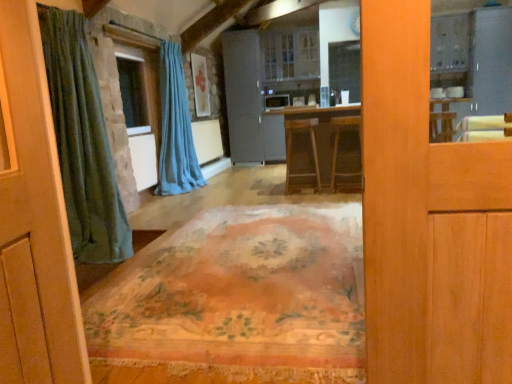
Question: Is blue fabric curtain at center directly adjacent to satin gray refrigerator at center, the second screen door when ordered from right to left?

Choices:
 (A) no
 (B) yes

Answer: (A)

Question: Does blue fabric curtain at center turn towards satin gray refrigerator at center, the 1th screen door from the left?

Choices:
 (A) yes
 (B) no

Answer: (B)

Question: Is blue fabric curtain at center smaller than satin gray refrigerator at center, the 1th screen door from the left?

Choices:
 (A) no
 (B) yes

Answer: (B)

Question: From the image's perspective, is blue fabric curtain at center located above satin gray refrigerator at center, the 1th screen door from the left?

Choices:
 (A) yes
 (B) no

Answer: (B)

Question: Is blue fabric curtain at center to the left of satin gray refrigerator at center, the 1th screen door from the left, from the viewer's perspective?

Choices:
 (A) yes
 (B) no

Answer: (A)

Question: Is blue fabric curtain at center located outside satin gray refrigerator at center, the 1th screen door from the left?

Choices:
 (A) no
 (B) yes

Answer: (B)

Question: Is blue fabric curtain at center taller than matte gray cabinet at center?

Choices:
 (A) no
 (B) yes

Answer: (B)

Question: From a real-world perspective, is blue fabric curtain at center positioned over matte gray cabinet at center based on gravity?

Choices:
 (A) yes
 (B) no

Answer: (B)

Question: Are blue fabric curtain at center and matte gray cabinet at center located far from each other?

Choices:
 (A) no
 (B) yes

Answer: (B)

Question: From the image's perspective, does blue fabric curtain at center appear higher than matte gray cabinet at center?

Choices:
 (A) yes
 (B) no

Answer: (B)

Question: From the image's perspective, is blue fabric curtain at center located beneath matte gray cabinet at center?

Choices:
 (A) no
 (B) yes

Answer: (B)

Question: Is blue fabric curtain at center in contact with matte gray cabinet at center?

Choices:
 (A) yes
 (B) no

Answer: (B)

Question: From the image's perspective, is white glossy cabinet at upper right, the 1th screen door viewed from the right, located beneath stone window at center?

Choices:
 (A) no
 (B) yes

Answer: (A)